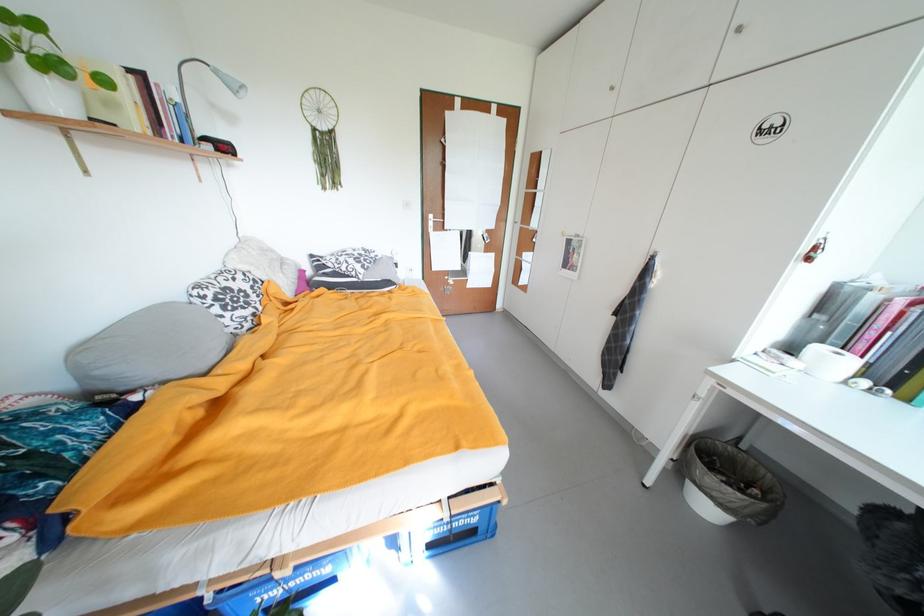
Describe the element at coordinates (229, 83) in the screenshot. The width and height of the screenshot is (924, 616). I see `the grey lamp head` at that location.